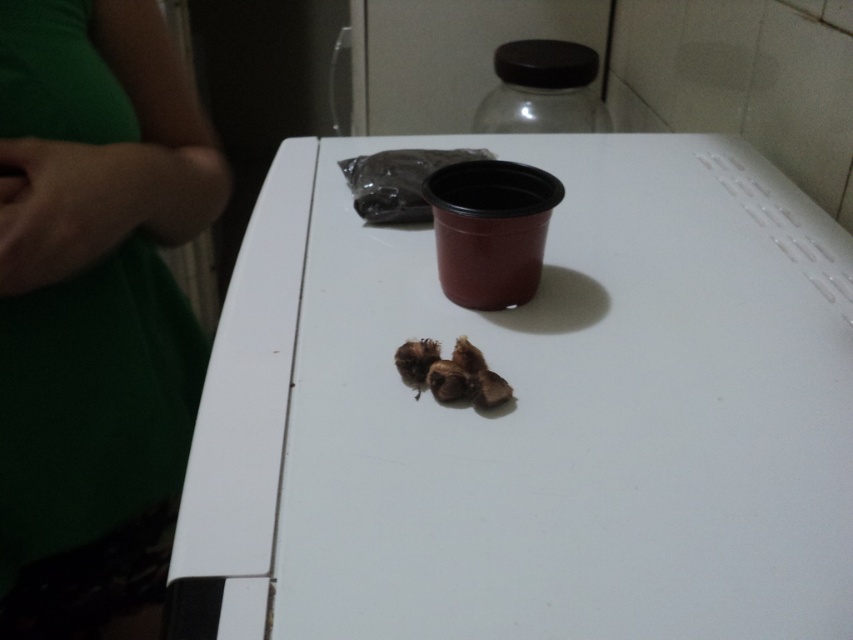
Who is more distant from viewer, (90, 252) or (469, 381)?

The point (90, 252) is behind.

Between green fabric at left and brown matte nuts at center, which one appears on the right side from the viewer's perspective?

brown matte nuts at center

Describe the element at coordinates (94, 310) in the screenshot. The height and width of the screenshot is (640, 853). I see `green fabric at left` at that location.

This screenshot has width=853, height=640. Find the location of `green fabric at left`. green fabric at left is located at coordinates (94, 310).

Does white matte table at center have a greater height compared to brown matte nuts at center?

Correct, white matte table at center is much taller as brown matte nuts at center.

Consider the image. Is white matte table at center to the left of brown matte nuts at center from the viewer's perspective?

In fact, white matte table at center is to the right of brown matte nuts at center.

Where is `white matte table at center`? white matte table at center is located at coordinates (537, 413).

Is white matte table at center smaller than green fabric at left?

Incorrect, white matte table at center is not smaller in size than green fabric at left.

Where is `white matte table at center`? The image size is (853, 640). white matte table at center is located at coordinates (537, 413).

You are a GUI agent. You are given a task and a screenshot of the screen. Output one action in this format:
    pyautogui.click(x=<x>, y=<y>)
    Task: Click on the white matte table at center
    
    Given the screenshot: What is the action you would take?
    pyautogui.click(x=537, y=413)